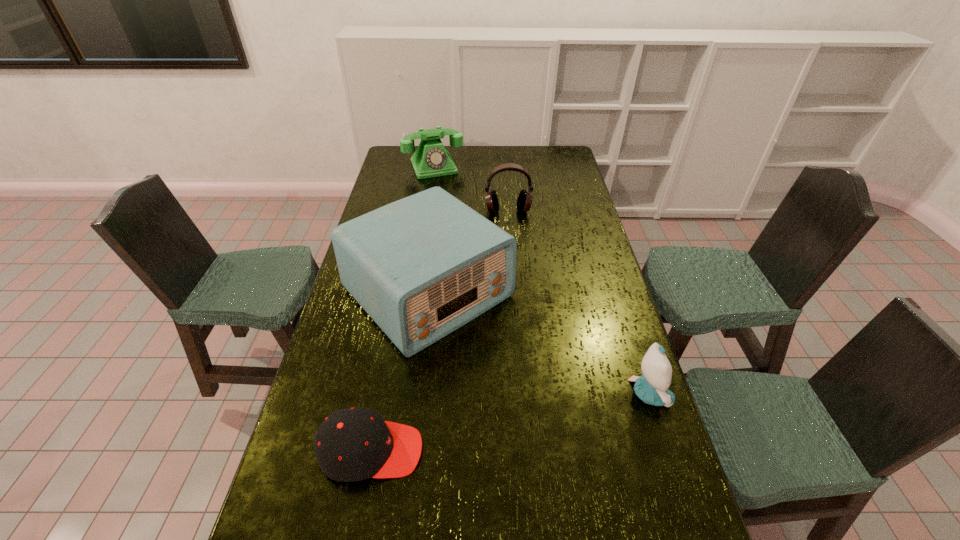
Image resolution: width=960 pixels, height=540 pixels. I want to click on cap present at the left edge, so click(352, 444).

Where is `radio receiver that is at the left edge`? radio receiver that is at the left edge is located at coordinates (423, 266).

In order to click on telephone positioned at the left edge in this screenshot , I will do `click(431, 159)`.

At what (x,y) coordinates should I click in order to perform the action: click on object that is at the right edge. Please return your answer as a coordinate pair (x, y). The width and height of the screenshot is (960, 540). Looking at the image, I should click on (652, 387).

Image resolution: width=960 pixels, height=540 pixels. Find the location of `object located at the far left corner`. object located at the far left corner is located at coordinates (431, 159).

Image resolution: width=960 pixels, height=540 pixels. In order to click on object present at the near left corner in this screenshot , I will do pos(352,444).

In the image, there is a desktop. In order to click on vacant space at the far edge in this screenshot , I will do `click(484, 155)`.

Find the location of a particular element. The height and width of the screenshot is (540, 960). vacant space at the near edge of the desktop is located at coordinates (590, 514).

At what (x,y) coordinates should I click in order to perform the action: click on free point at the left edge. Please return your answer as a coordinate pair (x, y). The height and width of the screenshot is (540, 960). Looking at the image, I should click on [x=414, y=170].

Locate an element on the screen. vacant area at the right edge is located at coordinates (591, 339).